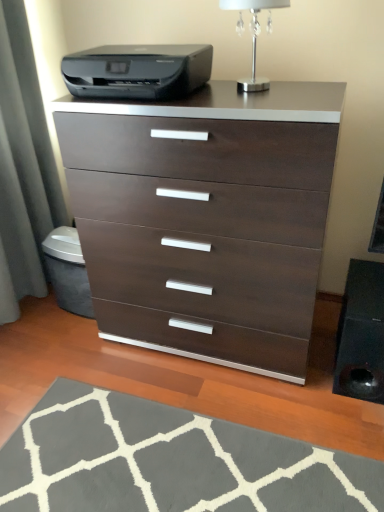
I want to click on free space in front of silver metallic table lamp at upper center, so click(256, 101).